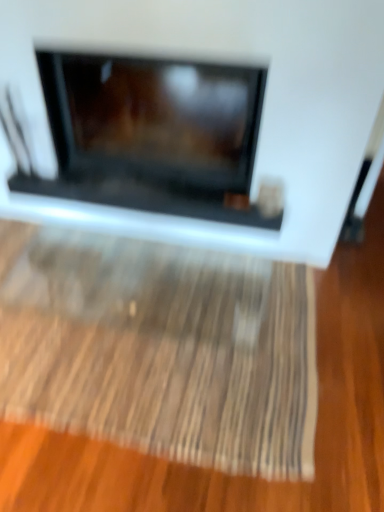
Question: Is wooden textured mat at center bigger than matte black fireplace at center?

Choices:
 (A) no
 (B) yes

Answer: (A)

Question: Is wooden textured mat at center to the left of matte black fireplace at center from the viewer's perspective?

Choices:
 (A) no
 (B) yes

Answer: (B)

Question: Is wooden textured mat at center turned away from matte black fireplace at center?

Choices:
 (A) yes
 (B) no

Answer: (A)

Question: Is wooden textured mat at center positioned beyond the bounds of matte black fireplace at center?

Choices:
 (A) no
 (B) yes

Answer: (B)

Question: Can matte black fireplace at center be found inside wooden textured mat at center?

Choices:
 (A) yes
 (B) no

Answer: (B)

Question: Does wooden textured mat at center have a smaller size compared to matte black fireplace at center?

Choices:
 (A) yes
 (B) no

Answer: (A)

Question: Is matte black fireplace at center at the left side of wooden textured mat at center?

Choices:
 (A) no
 (B) yes

Answer: (A)

Question: Is wooden textured mat at center a part of matte black fireplace at center?

Choices:
 (A) no
 (B) yes

Answer: (A)

Question: Is matte black fireplace at center positioned with its back to wooden textured mat at center?

Choices:
 (A) yes
 (B) no

Answer: (B)

Question: Is matte black fireplace at center closer to camera compared to wooden textured mat at center?

Choices:
 (A) no
 (B) yes

Answer: (B)

Question: Considering the relative positions of matte black fireplace at center and wooden textured mat at center in the image provided, is matte black fireplace at center to the right of wooden textured mat at center from the viewer's perspective?

Choices:
 (A) yes
 (B) no

Answer: (A)

Question: Does matte black fireplace at center have a greater width compared to wooden textured mat at center?

Choices:
 (A) no
 (B) yes

Answer: (A)

Question: In terms of width, does wooden textured mat at center look wider or thinner when compared to matte black fireplace at center?

Choices:
 (A) thin
 (B) wide

Answer: (B)